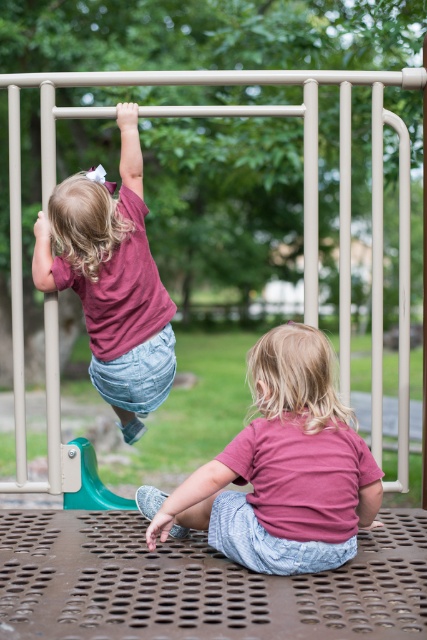
You are a photographer trying to capture both the pink fabric shirt at lower center and the matte pink shirt at upper left in a single shot. Which of the two shirts should you focus on first to ensure they both fit in the frame?

The pink fabric shirt at lower center occupies less space than the matte pink shirt at upper left, so you should focus on the matte pink shirt at upper left first to ensure both fit in the frame.

You are standing at the playground and see the point marked at coordinates (280, 468). Based on the scene description, what object or clothing item is located at that point?

The point at coordinates (280, 468) corresponds to the pink fabric shirt at lower center.

You are designing a new playground uniform and need to choose between two pink shirts. The pink fabric shirt at lower center and the matte pink shirt at upper left are both options. Based on their sizes, which one would you recommend for a child who prefers a roomier fit?

The pink fabric shirt at lower center has a larger width than the matte pink shirt at upper left, so it would be the better choice for a child who prefers a roomier fit.